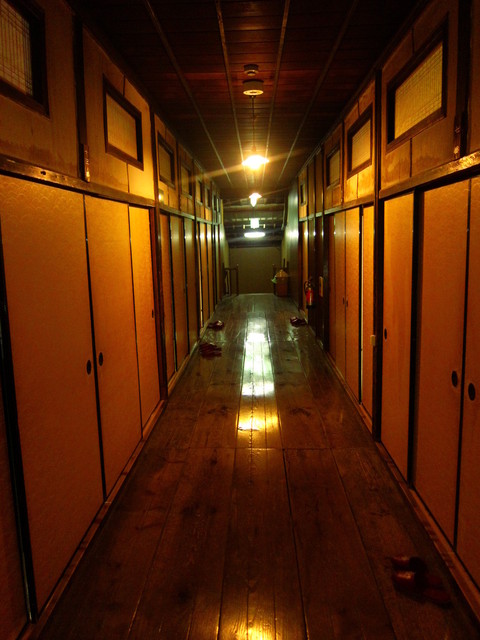
The width and height of the screenshot is (480, 640). Identify the location of ceiling. (265, 27).